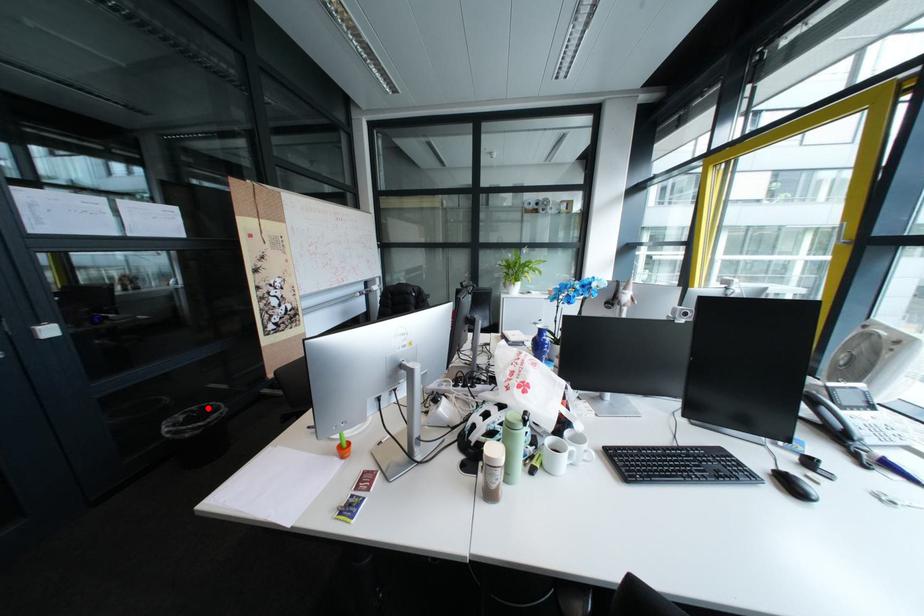
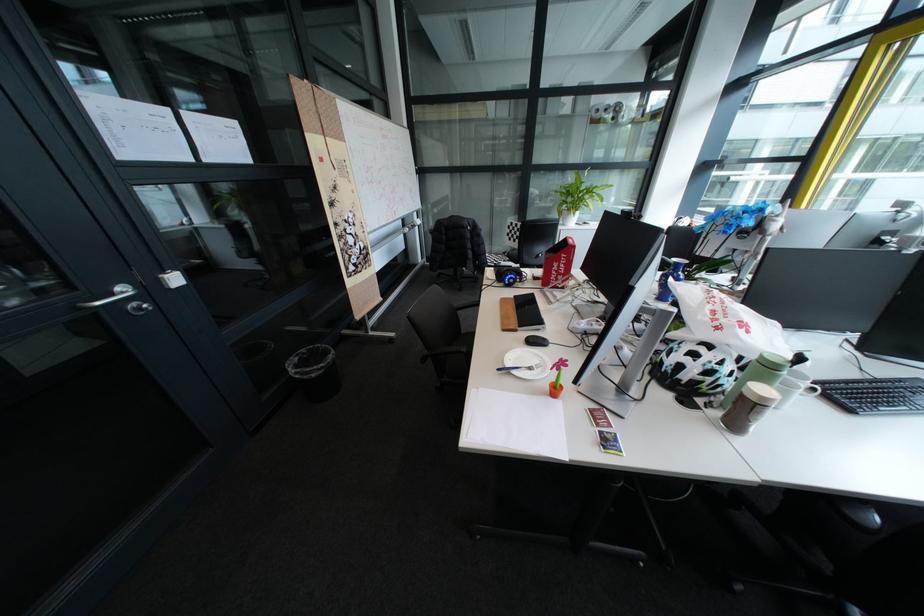
Question: I am providing you with two images of the same scene from different viewpoints. In image1, a red point is highlighted. Considering the same 3D point in image2, which of the following is correct?

Choices:
 (A) It is closer
 (B) It is farther

Answer: (A)